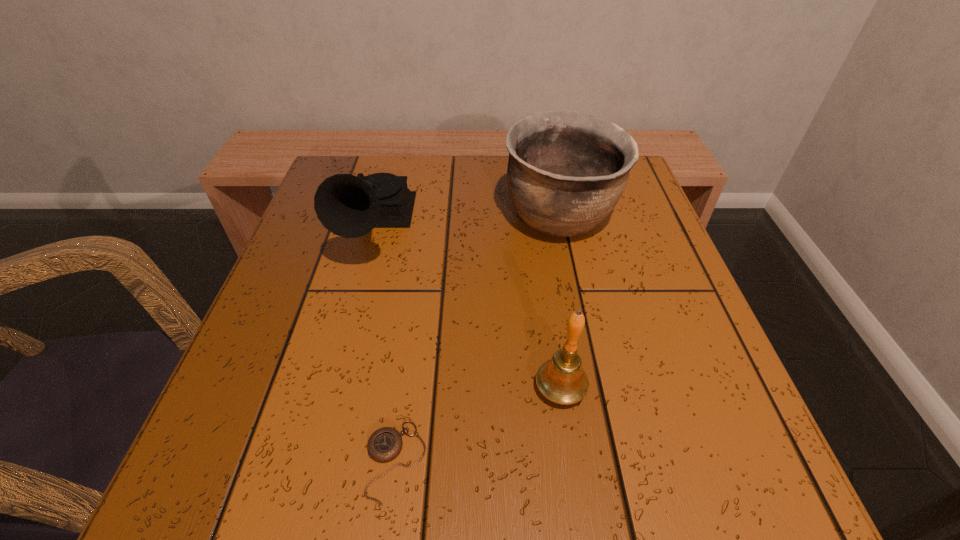
Identify which object is the second nearest to the second nearest object. Please provide its 2D coordinates. Your answer should be formatted as a tuple, i.e. [(x, y)], where the tuple contains the x and y coordinates of a point satisfying the conditions above.

[(567, 170)]

Where is `vacant region that satisfies the following two spatial constraints: 1. on the back side of the pocket watch; 2. on the right side of the third farthest object`? vacant region that satisfies the following two spatial constraints: 1. on the back side of the pocket watch; 2. on the right side of the third farthest object is located at coordinates (405, 388).

Locate an element on the screen. vacant space that satisfies the following two spatial constraints: 1. from the horn of the nearest object; 2. on the left side of the phonograph_record is located at coordinates (310, 461).

Find the location of a particular element. The height and width of the screenshot is (540, 960). vacant point that satisfies the following two spatial constraints: 1. from the horn of the phonograph_record; 2. on the right side of the nearest object is located at coordinates (310, 461).